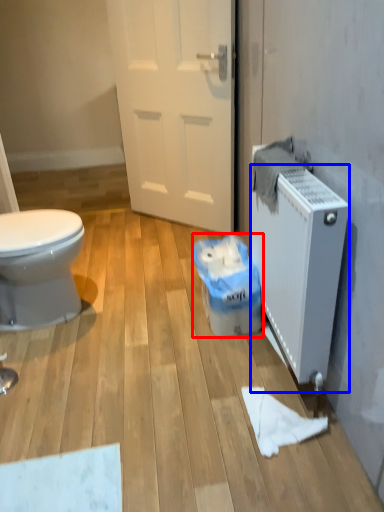
Question: Which object is further to the camera taking this photo, garbage (highlighted by a red box) or radiator (highlighted by a blue box)?

Choices:
 (A) garbage
 (B) radiator

Answer: (A)